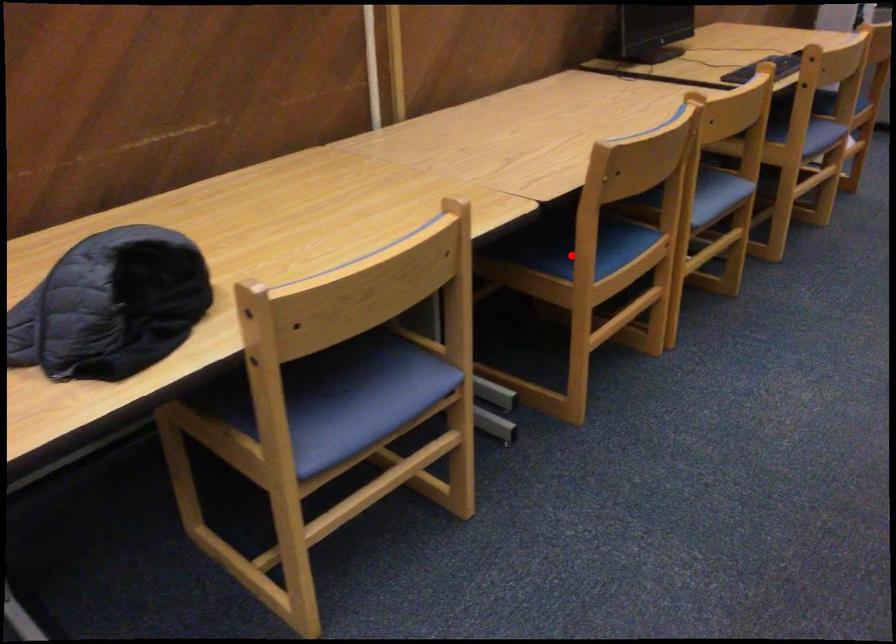
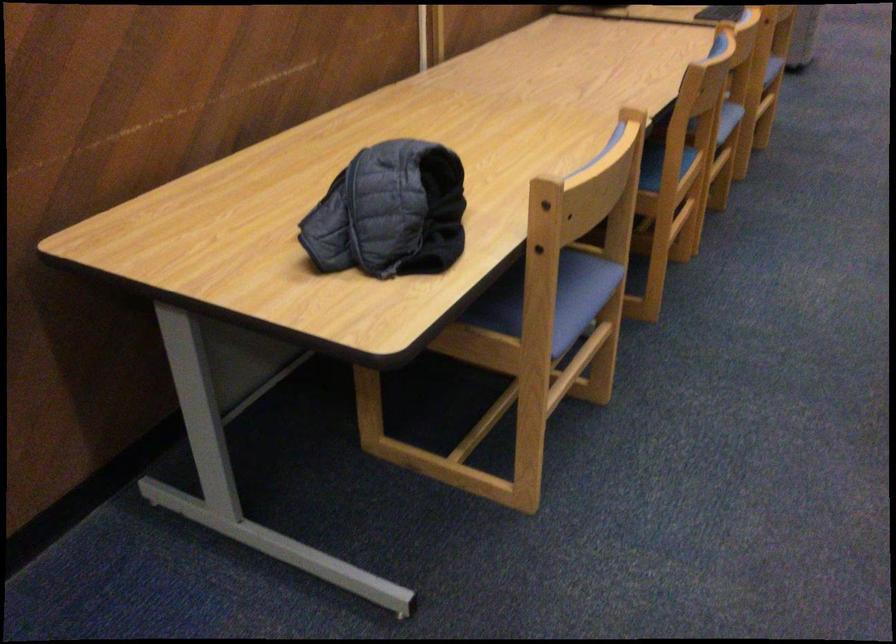
Find the pixel in the second image that matches the highlighted location in the first image.

(660, 167)